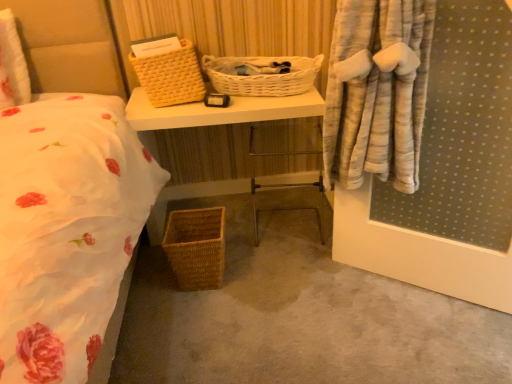
Where is `vacant area situated below matte wicker basket at center (from a real-world perspective)`? This screenshot has height=384, width=512. vacant area situated below matte wicker basket at center (from a real-world perspective) is located at coordinates (250, 208).